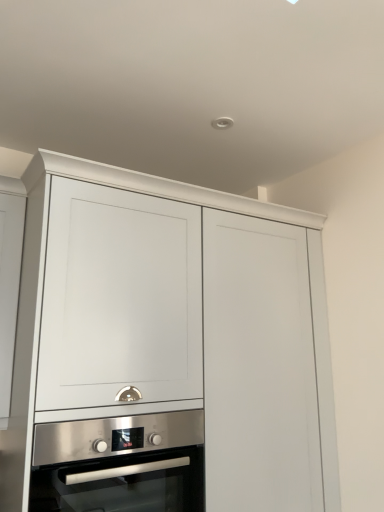
This screenshot has height=512, width=384. What do you see at coordinates (120, 464) in the screenshot? I see `stainless steel oven at center` at bounding box center [120, 464].

The width and height of the screenshot is (384, 512). I want to click on stainless steel oven at center, so click(120, 464).

This screenshot has width=384, height=512. What do you see at coordinates (167, 349) in the screenshot?
I see `matte white cabinet at center` at bounding box center [167, 349].

Measure the distance between matte white cabinet at center and camera.

The depth of matte white cabinet at center is 1.20 meters.

You are a GUI agent. You are given a task and a screenshot of the screen. Output one action in this format:
    pyautogui.click(x=<x>, y=<y>)
    Task: Click on the matte white cabinet at center
    
    Given the screenshot: What is the action you would take?
    pyautogui.click(x=167, y=349)

The width and height of the screenshot is (384, 512). Identify the location of stainless steel oven at center. (120, 464).

Looking at this image, is matte white cabinet at center to the right of stainless steel oven at center from the viewer's perspective?

Yes.

Is the position of matte white cabinet at center less distant than that of stainless steel oven at center?

Yes, it is.

Does point (169, 390) appear closer or farther from the camera than point (175, 453)?

Point (169, 390) is farther from the camera than point (175, 453).

From the image's perspective, between matte white cabinet at center and stainless steel oven at center, which one is located above?

From the image's view, matte white cabinet at center is above.

From a real-world perspective, is matte white cabinet at center positioned above or below stainless steel oven at center?

From a real-world perspective, matte white cabinet at center is physically above stainless steel oven at center.

Does matte white cabinet at center have a greater width compared to stainless steel oven at center?

Yes, matte white cabinet at center is wider than stainless steel oven at center.

Is matte white cabinet at center shorter than stainless steel oven at center?

No.

Who is smaller, matte white cabinet at center or stainless steel oven at center?

With smaller size is stainless steel oven at center.

Is matte white cabinet at center surrounding stainless steel oven at center?

Yes.

Is there a large distance between matte white cabinet at center and stainless steel oven at center?

No.

Based on the photo, is matte white cabinet at center looking in the opposite direction of stainless steel oven at center?

Yes, matte white cabinet at center's orientation is away from stainless steel oven at center.

How different are the orientations of matte white cabinet at center and stainless steel oven at center in degrees?

matte white cabinet at center and stainless steel oven at center are facing 0.00059 degrees away from each other.

Locate an element on the screen. The image size is (384, 512). cabinetry on the right of stainless steel oven at center is located at coordinates (167, 349).

Which is more to the left, stainless steel oven at center or matte white cabinet at center?

Positioned to the left is stainless steel oven at center.

Which is in front, stainless steel oven at center or matte white cabinet at center?

matte white cabinet at center is closer to the camera.

Which is behind, point (201, 439) or point (304, 265)?

The point (304, 265) is behind.

From the image's perspective, is stainless steel oven at center located above or below matte white cabinet at center?

stainless steel oven at center is below matte white cabinet at center.

From a real-world perspective, is stainless steel oven at center on matte white cabinet at center?

No, from a real-world perspective, stainless steel oven at center is not over matte white cabinet at center

Is stainless steel oven at center wider than matte white cabinet at center?

In fact, stainless steel oven at center might be narrower than matte white cabinet at center.

Is stainless steel oven at center taller than matte white cabinet at center?

In fact, stainless steel oven at center may be shorter than matte white cabinet at center.

Can you confirm if stainless steel oven at center is bigger than matte white cabinet at center?

No.

Is stainless steel oven at center not inside matte white cabinet at center?

No, stainless steel oven at center is inside matte white cabinet at center's boundary.

Is stainless steel oven at center far away from matte white cabinet at center?

No, stainless steel oven at center is not far away from matte white cabinet at center.

Is stainless steel oven at center positioned with its back to matte white cabinet at center?

Absolutely, stainless steel oven at center is directed away from matte white cabinet at center.

How much distance is there between stainless steel oven at center and matte white cabinet at center?

stainless steel oven at center is 9.85 inches from matte white cabinet at center.

Locate an element on the screen. oven that appears below the matte white cabinet at center (from the image's perspective) is located at coordinates (120, 464).

Locate an element on the screen. The width and height of the screenshot is (384, 512). cabinetry in front of the stainless steel oven at center is located at coordinates (167, 349).

Where is `oven below the matte white cabinet at center (from a real-world perspective)`? This screenshot has height=512, width=384. oven below the matte white cabinet at center (from a real-world perspective) is located at coordinates (120, 464).